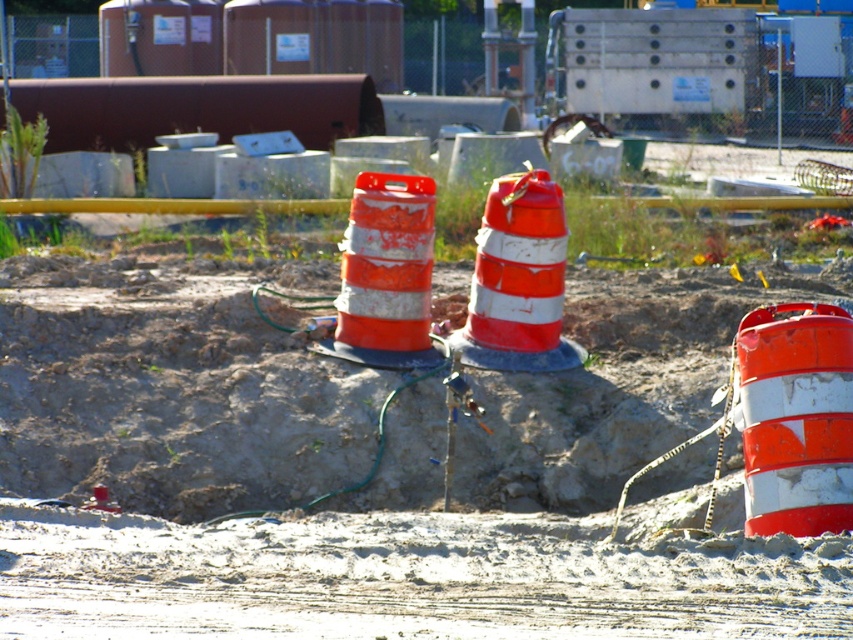
Between point (762, 456) and point (515, 269), which one is positioned in front?

Point (762, 456) is more forward.

Is point (842, 467) closer to viewer compared to point (474, 256)?

That is True.

At what (x,y) coordinates should I click in order to perform the action: click on orange and white striped traffic cone at center. Please return your answer as a coordinate pair (x, y). Image resolution: width=853 pixels, height=640 pixels. Looking at the image, I should click on [796, 419].

Does point (492, 321) come in front of point (404, 323)?

No, it is behind (404, 323).

Is orange reflective traffic cone at center above orange/white striped traffic cone at center?

No.

Image resolution: width=853 pixels, height=640 pixels. I want to click on orange reflective traffic cone at center, so click(x=519, y=280).

Based on the photo, is orange and white striped traffic cone at center in front of orange/white striped traffic cone at center?

Yes, it is in front of orange/white striped traffic cone at center.

In the scene shown: Who is more distant from viewer, [819,308] or [393,321]?

The point [393,321] is behind.

Identify the location of orange and white striped traffic cone at center. (796, 419).